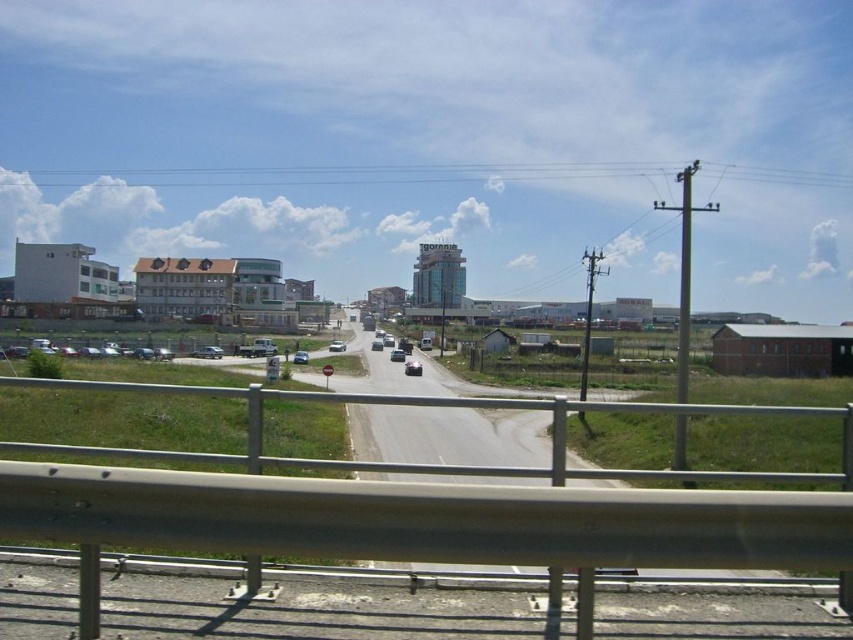
You are driving a car and notice two points marked on the road ahead. The first point is at coordinates point (212, 349) and the second is at point (399, 360). Which point is closer to your current position?

Point (212, 349) is closer to the viewer than point (399, 360).

You are driving a car and need to overtake the shiny silver sedan at center. There is a shiny silver car at center ahead of it. Can you safely pass the sedan without crossing the road divider? Please consider the distance between them.

The distance between the shiny silver car at center and the shiny silver sedan at center is 7.78 meters. Since the road curves gently to the right and there is enough space between them, you can safely overtake the sedan by staying within your lane if the following distance allows, but ensure you check for any road dividers or traffic rules prohibiting lane changes in that area.